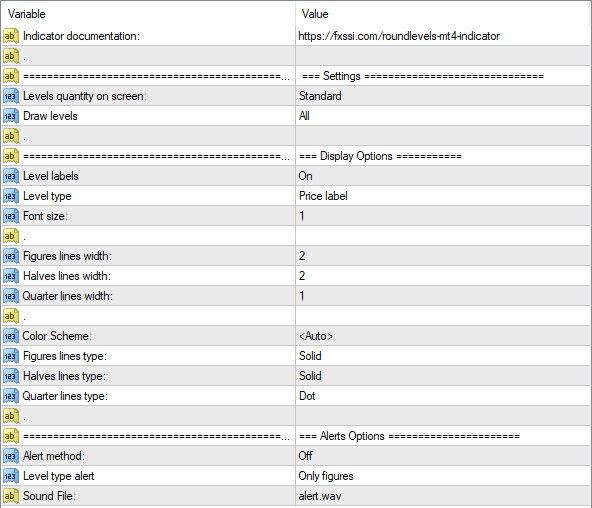
This screenshot has height=508, width=592. I want to click on boxes with nothing in them, so [340, 416], [340, 314], [357, 233], [377, 136], [379, 57].